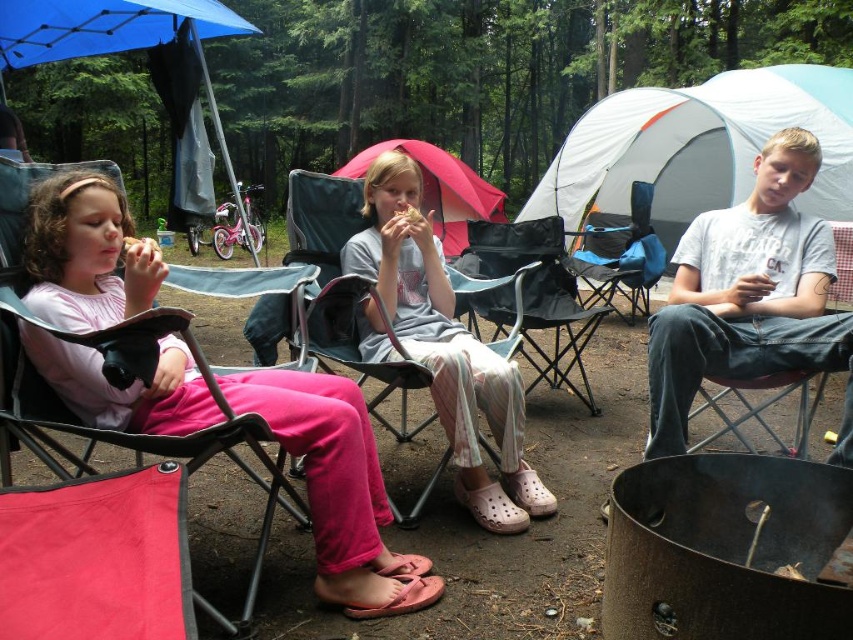
Does point (477, 248) come farther from viewer compared to point (844, 260)?

Yes, point (477, 248) is farther from viewer.

Who is shorter, black mesh chair at center or denim fabric chair at center?

denim fabric chair at center is shorter.

Does point (550, 310) come behind point (792, 387)?

Yes.

Locate an element on the screen. The width and height of the screenshot is (853, 640). black mesh chair at center is located at coordinates (527, 292).

Can you confirm if matte black folding chair at left is positioned to the left of matte pink tent at center?

Correct, you'll find matte black folding chair at left to the left of matte pink tent at center.

Is point (20, 248) in front of point (437, 184)?

Yes.

Is point (28, 410) positioned behind point (451, 237)?

No.

You are a GUI agent. You are given a task and a screenshot of the screen. Output one action in this format:
    pyautogui.click(x=<x>, y=<y>)
    Task: Click on the matte black folding chair at left
    
    Given the screenshot: What is the action you would take?
    pyautogui.click(x=119, y=381)

Does point (548, 316) come in front of point (473, 182)?

Yes, it is.

Between black mesh chair at center and matte pink tent at center, which one appears on the left side from the viewer's perspective?

matte pink tent at center is more to the left.

This screenshot has width=853, height=640. Find the location of `black mesh chair at center`. black mesh chair at center is located at coordinates (527, 292).